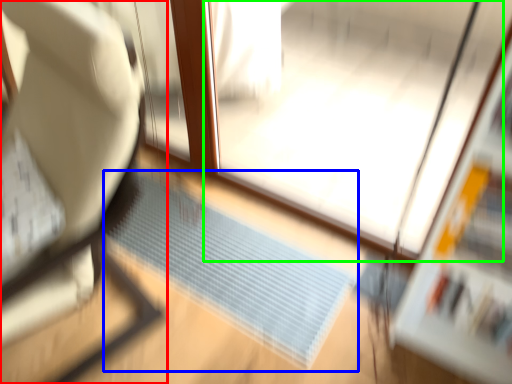
Question: Considering the real-world distances, which object is closest to furniture (highlighted by a red box)? doormat (highlighted by a blue box) or screen door (highlighted by a green box).

Choices:
 (A) doormat
 (B) screen door

Answer: (A)